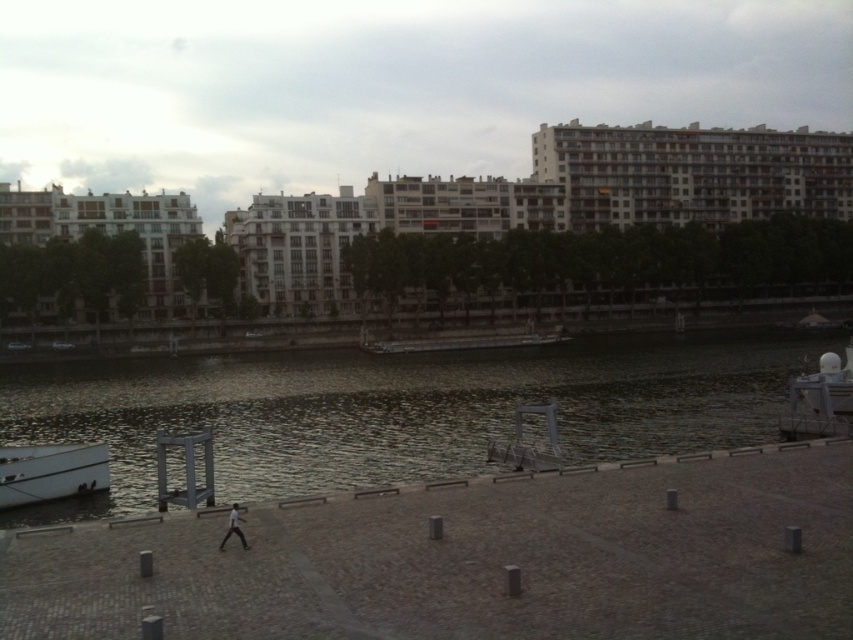
Question: Does dark water at center appear under white matte boat at lower left?

Choices:
 (A) yes
 (B) no

Answer: (B)

Question: Is dark water at center below white matte boat at lower left?

Choices:
 (A) yes
 (B) no

Answer: (B)

Question: Does dark water at center have a larger size compared to white matte boat at lower left?

Choices:
 (A) no
 (B) yes

Answer: (B)

Question: Which point is farther from the camera taking this photo?

Choices:
 (A) (763, 333)
 (B) (19, 502)

Answer: (A)